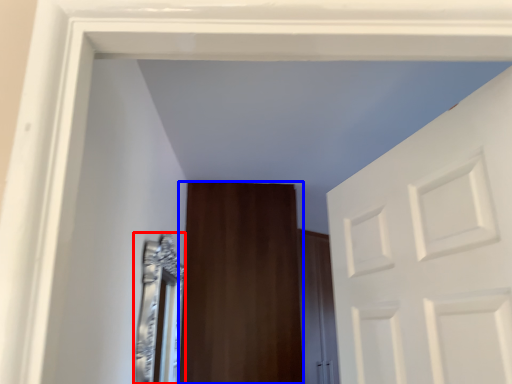
Question: Which object appears closest to the camera in this image, mirror (highlighted by a red box) or door (highlighted by a blue box)?

Choices:
 (A) mirror
 (B) door

Answer: (A)